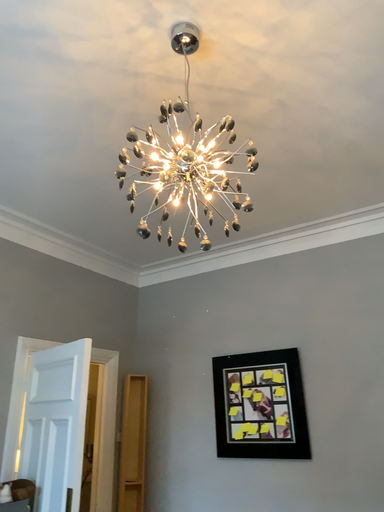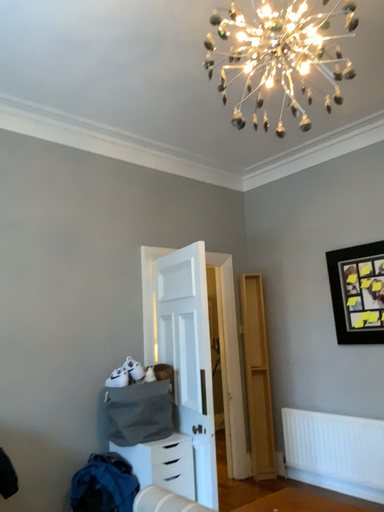
Question: How did the camera likely rotate when shooting the video?

Choices:
 (A) rotated right
 (B) rotated left

Answer: (B)